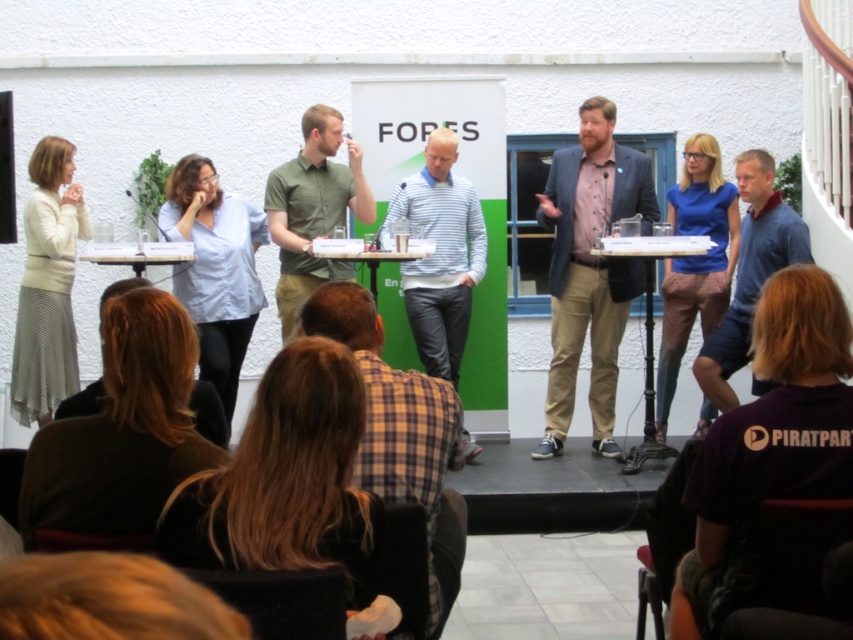
Who is more forward, (x=44, y=394) or (x=354, y=209)?

Point (x=44, y=394)

Can you confirm if white knit sweater at left is wider than green matte shirt at center?

No.

This screenshot has width=853, height=640. What are the coordinates of `white knit sweater at left` in the screenshot? It's located at (47, 285).

Is point (564, 381) farther from viewer compared to point (25, 280)?

Yes, it is.

Is blue shirt at center wider than white knit sweater at left?

Correct, the width of blue shirt at center exceeds that of white knit sweater at left.

In order to click on blue shirt at center in this screenshot , I will do `click(590, 269)`.

The width and height of the screenshot is (853, 640). Identify the location of blue shirt at center. (590, 269).

Who is shorter, blonde hair at lower center or matte blue shirt at center?

Standing shorter between the two is blonde hair at lower center.

In order to click on blonde hair at lower center in this screenshot , I will do `click(286, 481)`.

Locate an element on the screen. blonde hair at lower center is located at coordinates (286, 481).